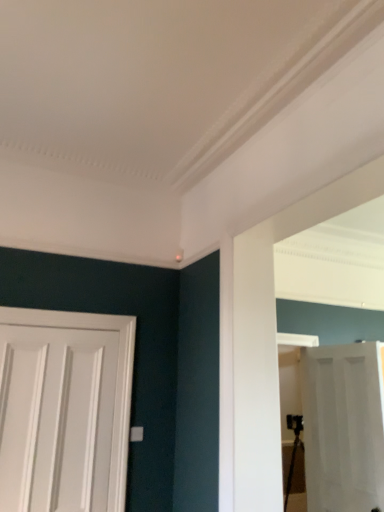
Question: Are white matte door at left, placed as the 1th door when sorted from front to back, and white matte door at right, which ranks as the 2th door in front-to-back order, located far from each other?

Choices:
 (A) no
 (B) yes

Answer: (B)

Question: Can you confirm if white matte door at left, placed as the 1th door when sorted from front to back, is shorter than white matte door at right, placed as the second door when sorted from left to right?

Choices:
 (A) yes
 (B) no

Answer: (A)

Question: Does white matte door at left, the 2th door from the right, have a smaller size compared to white matte door at right, placed as the second door when sorted from left to right?

Choices:
 (A) no
 (B) yes

Answer: (B)

Question: From a real-world perspective, is white matte door at left, marked as the 2th door in a back-to-front arrangement, physically below white matte door at right, the 1th door positioned from the right?

Choices:
 (A) yes
 (B) no

Answer: (B)

Question: Is white matte door at left, placed as the 1th door when sorted from front to back, oriented away from white matte door at right, which ranks as the 2th door in front-to-back order?

Choices:
 (A) no
 (B) yes

Answer: (A)

Question: Considering the relative sizes of white matte door at left, marked as the 2th door in a back-to-front arrangement, and white matte door at right, which is counted as the 1th door, starting from the back, in the image provided, is white matte door at left, marked as the 2th door in a back-to-front arrangement, thinner than white matte door at right, which is counted as the 1th door, starting from the back,?

Choices:
 (A) yes
 (B) no

Answer: (A)

Question: Considering the relative sizes of white matte door at right, the 1th door positioned from the right, and white matte door at left, the 2th door from the right, in the image provided, is white matte door at right, the 1th door positioned from the right, taller than white matte door at left, the 2th door from the right,?

Choices:
 (A) yes
 (B) no

Answer: (A)

Question: Can you confirm if white matte door at right, which is counted as the 1th door, starting from the back, is bigger than white matte door at left, marked as the 2th door in a back-to-front arrangement?

Choices:
 (A) no
 (B) yes

Answer: (B)

Question: Considering the relative positions of white matte door at right, which ranks as the 2th door in front-to-back order, and white matte door at left, placed as the 1th door when sorted from front to back, in the image provided, is white matte door at right, which ranks as the 2th door in front-to-back order, in front of white matte door at left, placed as the 1th door when sorted from front to back,?

Choices:
 (A) yes
 (B) no

Answer: (B)

Question: From a real-world perspective, is white matte door at right, placed as the second door when sorted from left to right, on top of white matte door at left, placed as the 1th door when sorted from front to back?

Choices:
 (A) no
 (B) yes

Answer: (A)

Question: Is white matte door at right, which ranks as the 2th door in front-to-back order, thinner than white matte door at left, marked as the 2th door in a back-to-front arrangement?

Choices:
 (A) yes
 (B) no

Answer: (B)

Question: Is white matte door at right, which ranks as the 2th door in front-to-back order, facing away from white matte door at left, the 2th door from the right?

Choices:
 (A) no
 (B) yes

Answer: (A)

Question: In terms of size, does white matte door at right, which is counted as the 1th door, starting from the back, appear bigger or smaller than white matte door at left, marked as the 2th door in a back-to-front arrangement?

Choices:
 (A) big
 (B) small

Answer: (A)